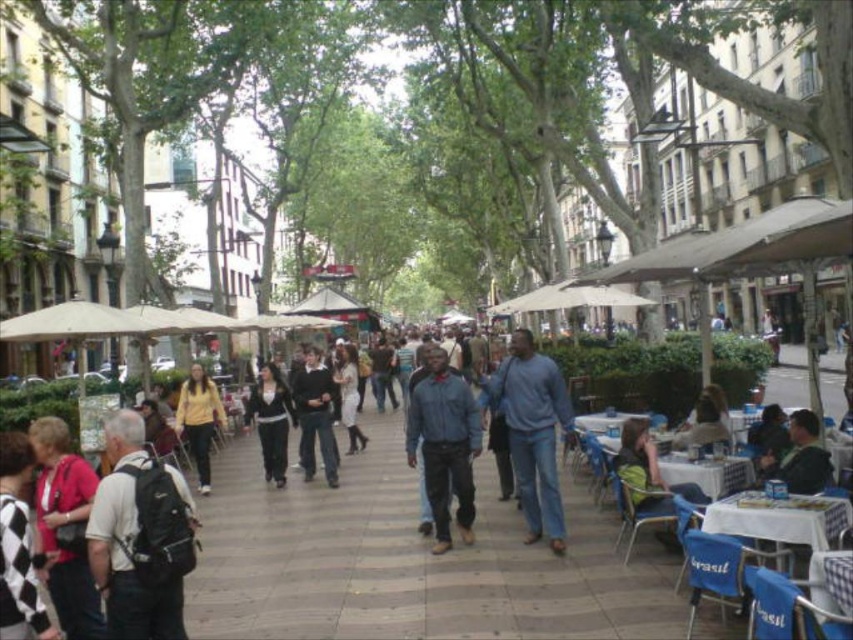
Question: Does denim jacket at center appear on the left side of light brown leather jacket at lower right?

Choices:
 (A) yes
 (B) no

Answer: (A)

Question: Does blue cotton shirt at center appear under green fabric shirt at lower right?

Choices:
 (A) yes
 (B) no

Answer: (B)

Question: Which point is closer to the camera?

Choices:
 (A) (546, 509)
 (B) (711, 428)
 (C) (265, 474)
 (D) (828, 464)

Answer: (D)

Question: Does black fabric backpack at left have a lesser width compared to dark blue sweater at center?

Choices:
 (A) yes
 (B) no

Answer: (B)

Question: Which object is positioned closest to the matte yellow sweater at center?

Choices:
 (A) light brown leather jacket at lower right
 (B) green fabric shirt at lower right
 (C) dark blue sweater at center

Answer: (C)

Question: Which object is the farthest from the dark blue sweater at center?

Choices:
 (A) matte yellow sweater at center
 (B) denim jacket at center
 (C) blue cotton shirt at center

Answer: (C)